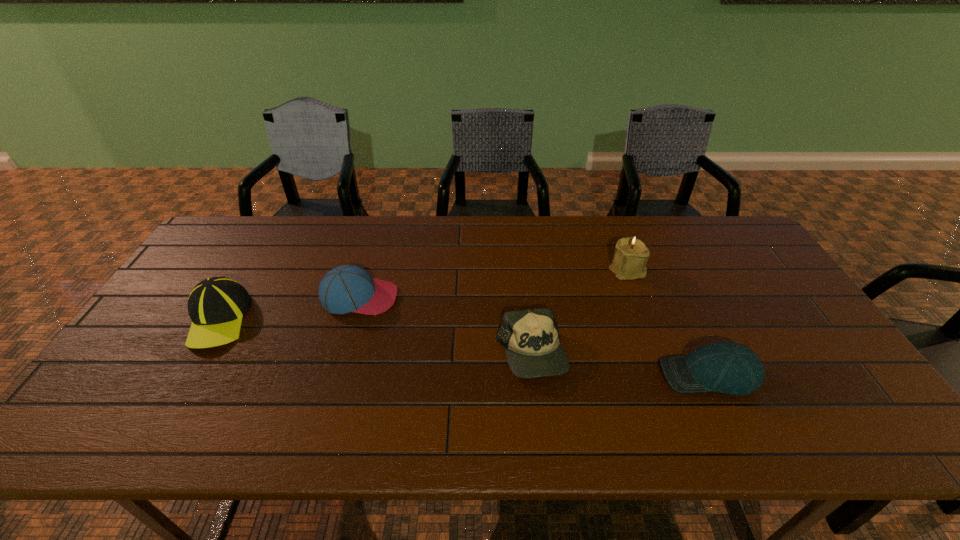
I want to click on free space in the image that satisfies the following two spatial constraints: 1. with the brim of the rightmost baseball cap facing forward; 2. on the right side of the leftmost object, so click(185, 375).

The image size is (960, 540). What are the coordinates of `vacant area in the image that satisfies the following two spatial constraints: 1. on the front side of the candle_holder; 2. on the front-facing side of the second object from left to right` in the screenshot? It's located at (637, 298).